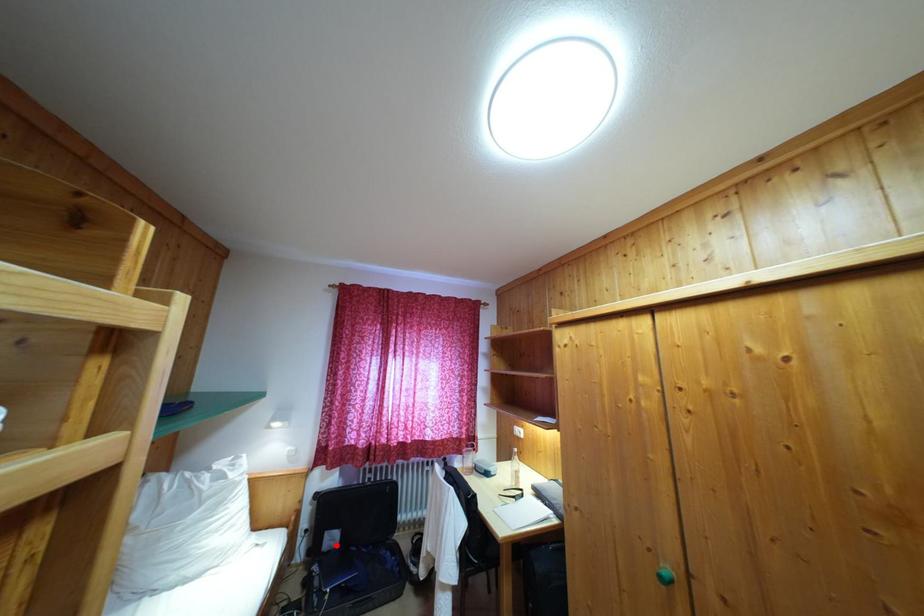
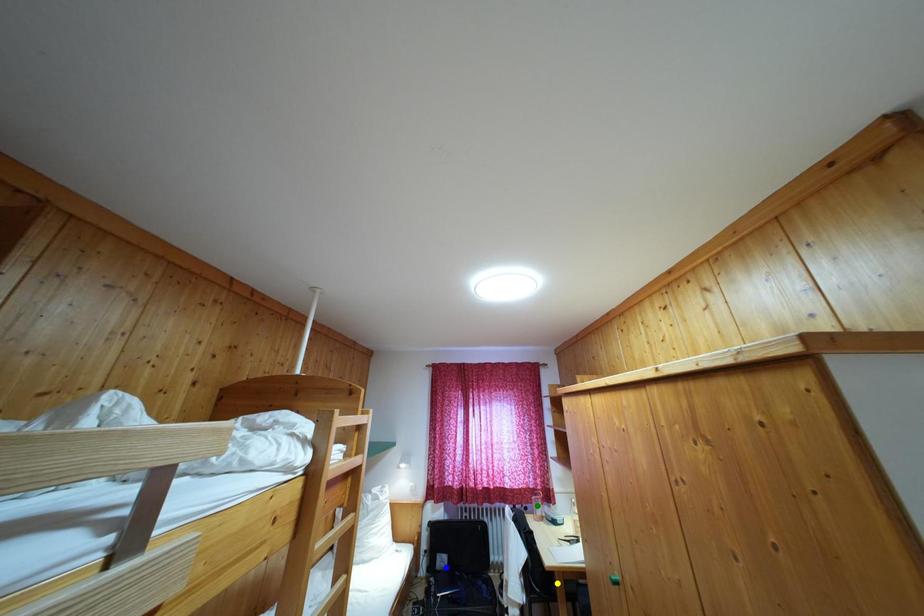
Question: I am providing you with two images of the same scene from different viewpoints. A red point is marked on the first image. You are given multiple points on the second image. Which point in image 2 is actually the same real-world point as the red point in image 1?

Choices:
 (A) green point
 (B) yellow point
 (C) blue point

Answer: (C)